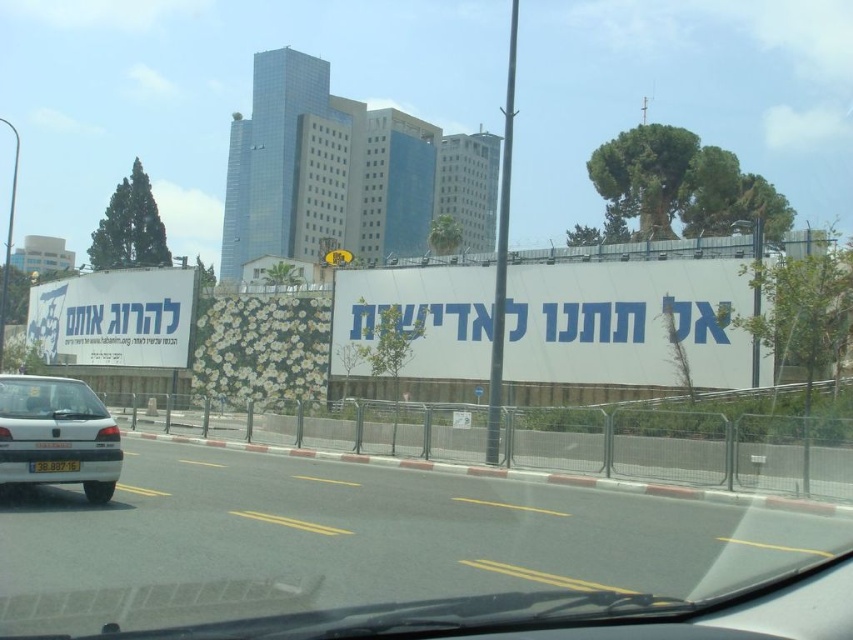
Which is behind, point (543, 522) or point (33, 461)?

Positioned behind is point (543, 522).

Who is lower down, gray asphalt highway at center or yellow plastic license plate at center?

gray asphalt highway at center is lower down.

Does point (225, 563) come behind point (36, 467)?

No, it is in front of (36, 467).

Where is `gray asphalt highway at center`? This screenshot has height=640, width=853. gray asphalt highway at center is located at coordinates (363, 540).

Does gray asphalt highway at center have a greater width compared to transparent glass windshield at lower left?

Yes, gray asphalt highway at center is wider than transparent glass windshield at lower left.

Is gray asphalt highway at center bigger than transparent glass windshield at lower left?

Indeed, gray asphalt highway at center has a larger size compared to transparent glass windshield at lower left.

Image resolution: width=853 pixels, height=640 pixels. What do you see at coordinates (363, 540) in the screenshot?
I see `gray asphalt highway at center` at bounding box center [363, 540].

Find the location of `gray asphalt highway at center`. gray asphalt highway at center is located at coordinates (363, 540).

Is silver metallic car at left behind transparent glass windshield at lower left?

No, it is in front of transparent glass windshield at lower left.

Which is in front, point (33, 394) or point (67, 396)?

Point (33, 394) is in front.

Locate an element on the screen. silver metallic car at left is located at coordinates (57, 433).